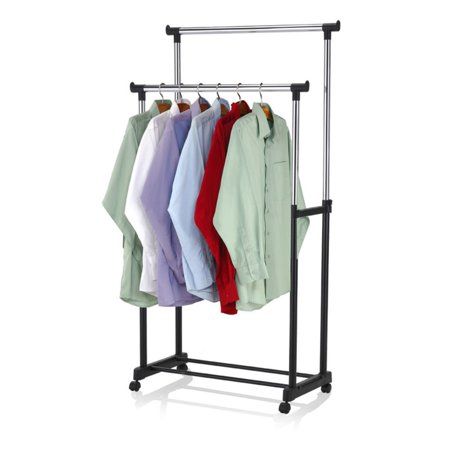
This screenshot has height=450, width=450. I want to click on clothes hangers, so click(163, 104), click(184, 104), click(205, 105), click(224, 106), click(240, 96), click(261, 94).